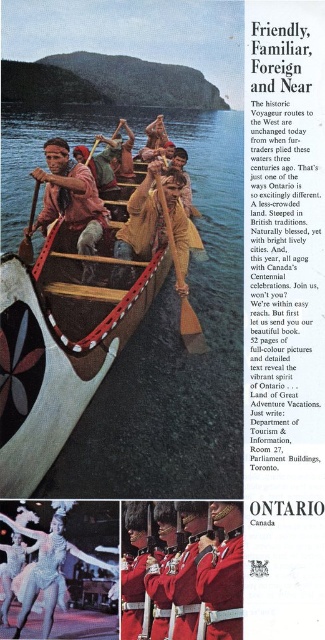
You are a photographer planning to take a photo of the brown wooden canoe at center and the red woolen coat at center for a historical exhibit. Which object should you focus on first if you want to emphasize the larger item in your composition?

The brown wooden canoe at center is larger in size than the red woolen coat at center, so you should focus on the brown wooden canoe at center first to emphasize its size in the composition.

You are an artist analyzing the vintage Ontario advertisement. You notice the red woolen hat at center and the brown wooden paddle at center. Which object appears taller in the image?

The brown wooden paddle at center is taller than the red woolen hat at center.